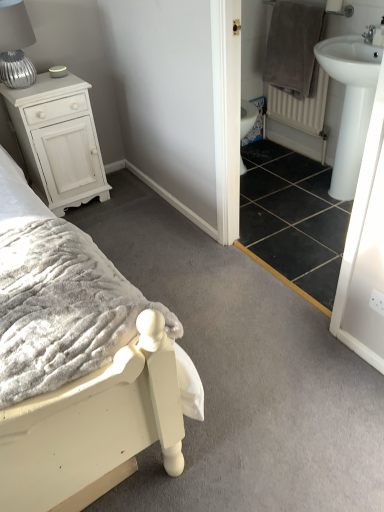
Question: Is point (18, 133) positioned closer to the camera than point (362, 251)?

Choices:
 (A) closer
 (B) farther

Answer: (B)

Question: In terms of size, does white painted wood chest of drawers at upper left appear bigger or smaller than white glossy sink at right?

Choices:
 (A) big
 (B) small

Answer: (A)

Question: Which object is the farthest from the white textured radiator at right?

Choices:
 (A) gray plush towel at upper right
 (B) silver ribbed table lamp at left
 (C) white painted wood chest of drawers at upper left
 (D) white glossy sink at right
 (E) white textured bed at center

Answer: (E)

Question: Estimate the real-world distances between objects in this image. Which object is farther from the white painted wood chest of drawers at upper left?

Choices:
 (A) white glossy bidet at center
 (B) gray plush towel at upper right
 (C) white textured radiator at right
 (D) white glossy sink at right
 (E) silver ribbed table lamp at left

Answer: (C)